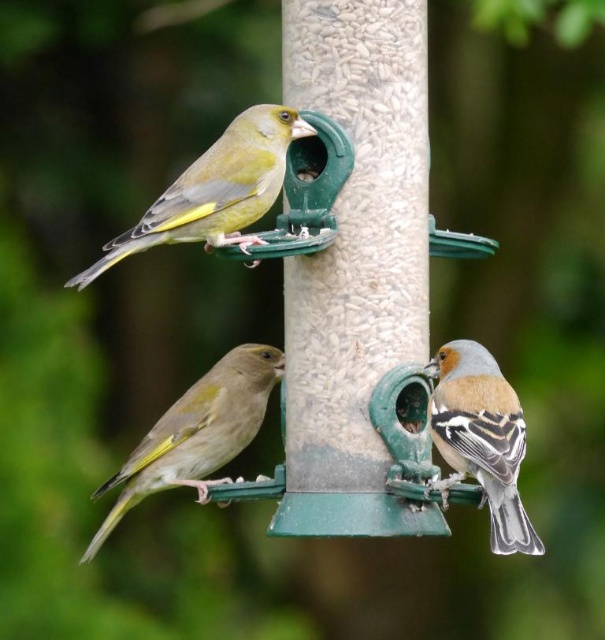
You are a bird watching enthusiast standing in front of the bird feeder. You notice two points marked on the feeder at coordinates point (363, 342) and point (220, 202). Which point is closer to you?

Point (220, 202) is closer to you because it is in front of point (363, 342).

You are standing in a park and see a bird feeder with three birds. You want to take a photo of the point at coordinates point [191,236] without moving closer. Can you focus on that point from your current position?

The point [191,236] is 7.45 feet away from camera, so yes, you can focus on that point from your current position as it is within a typical camera focusing range.